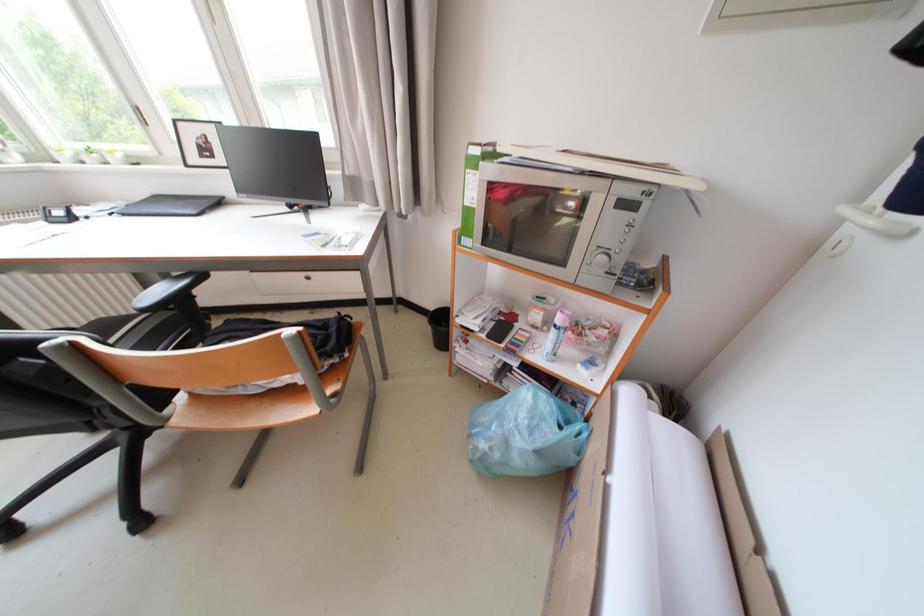
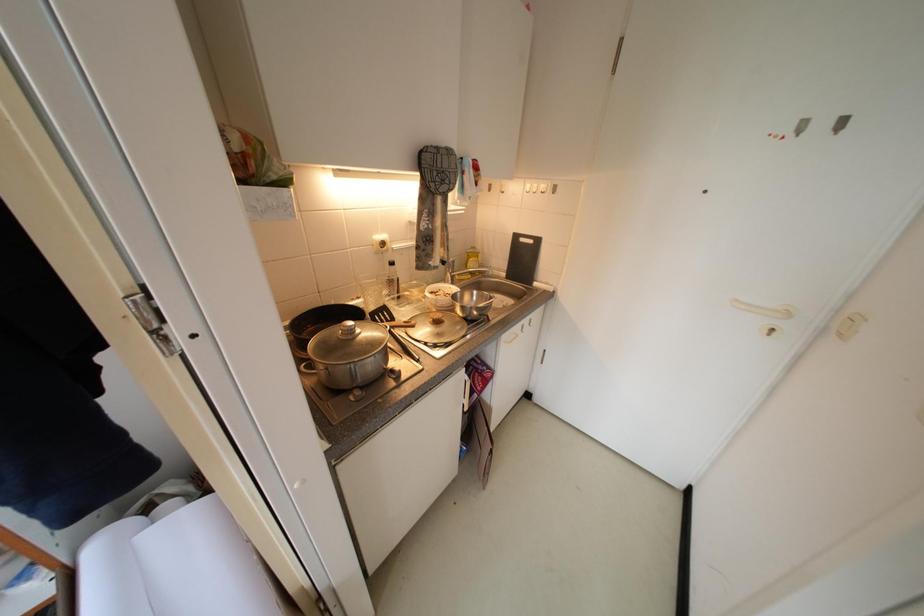
Based on the continuous images, in which direction is the camera rotating?

The camera rotated toward right-down.